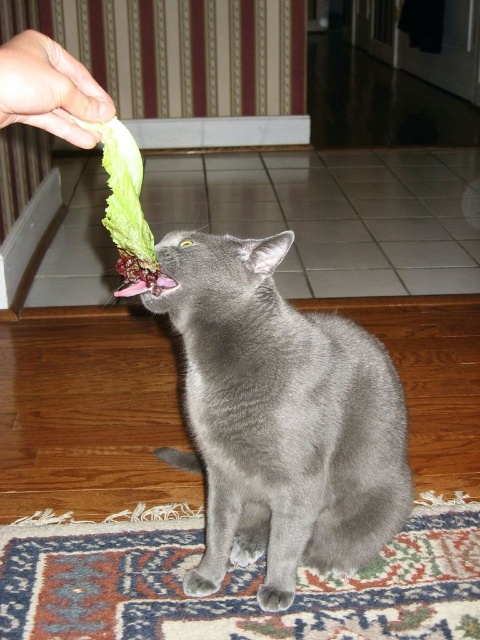
You are a photographer trying to capture a closeup shot of the smooth gray cat at center and the pink glossy lips at center. Your camera has a maximum focus range of 18 inches. Can you fit both subjects into the frame without moving the camera?

The smooth gray cat at center and the pink glossy lips at center are 17.85 inches apart from each other, which is within the camera maximum focus range of 18 inches. Therefore, you can fit both subjects into the frame without moving the camera.

You are a robot with a camera that has a maximum focus range of 30 centimeters. You are positioned to observe the smooth skin hand at upper left and the pink glossy lips at center. Can your camera focus on both objects simultaneously?

The distance between the smooth skin hand at upper left and pink glossy lips at center is 31.54 centimeters. Since the camera can only focus within 30 centimeters, it cannot focus on both objects at the same time.

You are a photographer trying to capture the interaction between the smooth skin hand at upper left and the pink glossy lips at center. Based on their positions, which object is positioned to the left?

The smooth skin hand at upper left is positioned to the left of the pink glossy lips at center.